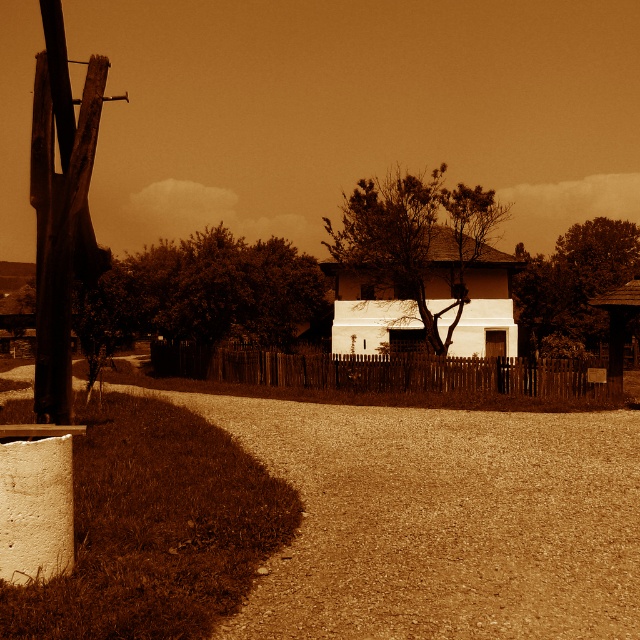
Who is higher up, smooth white tree at center or smooth bark tree at center?

smooth white tree at center

Does smooth white tree at center appear on the left side of smooth bark tree at center?

Yes, smooth white tree at center is to the left of smooth bark tree at center.

Where is `smooth white tree at center`? smooth white tree at center is located at coordinates (422, 268).

Looking at this image, is dirt gravel at lower center wider than thick textured tree at center?

Incorrect, dirt gravel at lower center's width does not surpass thick textured tree at center's.

Can you confirm if dirt gravel at lower center is taller than thick textured tree at center?

No.

Where is `dirt gravel at lower center`? This screenshot has width=640, height=640. dirt gravel at lower center is located at coordinates (442, 518).

Find the location of `dirt gravel at lower center`. dirt gravel at lower center is located at coordinates [442, 518].

Can you confirm if thick textured tree at center is shorter than smooth bark tree at center?

In fact, thick textured tree at center may be taller than smooth bark tree at center.

Is thick textured tree at center to the right of smooth bark tree at center from the viewer's perspective?

Incorrect, thick textured tree at center is not on the right side of smooth bark tree at center.

Does point (312, 259) come farther from viewer compared to point (568, 228)?

No, (312, 259) is in front of (568, 228).

I want to click on thick textured tree at center, so click(x=202, y=294).